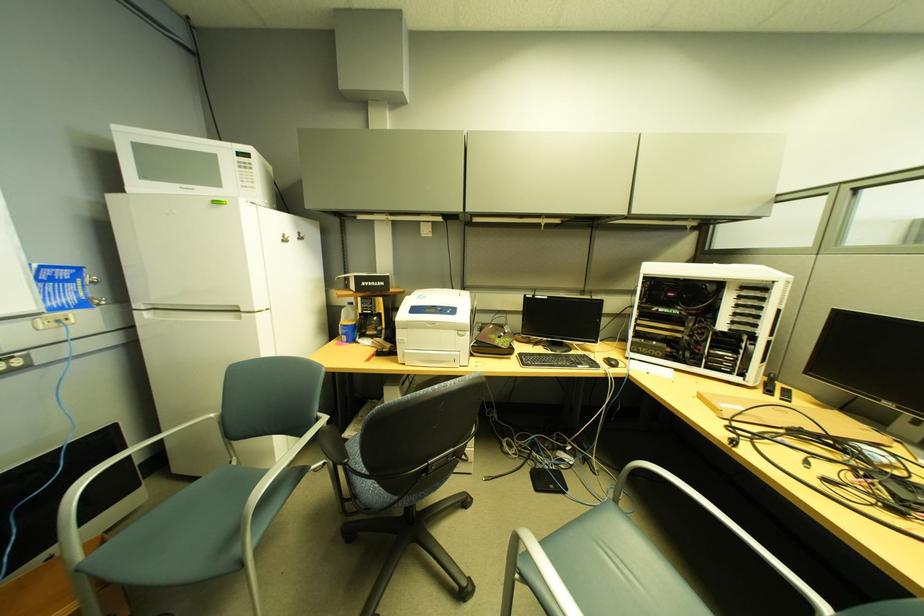
The height and width of the screenshot is (616, 924). In order to click on red power switch in this screenshot , I will do `click(53, 321)`.